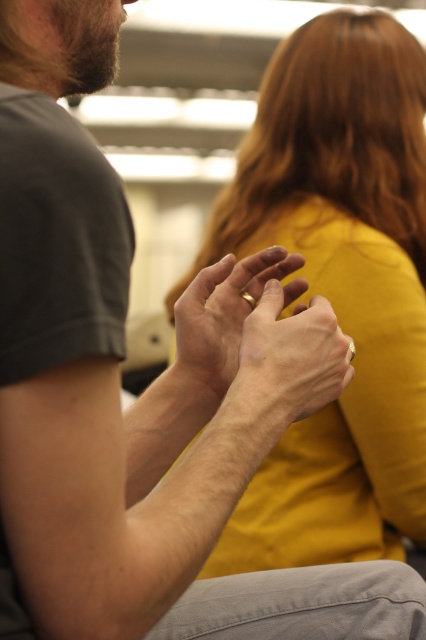
Question: Among these objects, which one is nearest to the camera?

Choices:
 (A) smooth skin hands at center
 (B) matte gold ring at center
 (C) mustard yellow fabric at upper right

Answer: (A)

Question: Does smooth skin hands at center come in front of matte gold ring at center?

Choices:
 (A) no
 (B) yes

Answer: (B)

Question: Estimate the real-world distances between objects in this image. Which object is closer to the mustard yellow fabric at upper right?

Choices:
 (A) matte gold ring at center
 (B) smooth skin hands at center

Answer: (A)

Question: Which is nearer to the matte gold ring at center?

Choices:
 (A) smooth skin hands at center
 (B) mustard yellow fabric at upper right

Answer: (A)

Question: Considering the relative positions of mustard yellow fabric at upper right and matte gold ring at center in the image provided, where is mustard yellow fabric at upper right located with respect to matte gold ring at center?

Choices:
 (A) left
 (B) right

Answer: (B)

Question: Observing the image, what is the correct spatial positioning of mustard yellow fabric at upper right in reference to smooth skin hands at center?

Choices:
 (A) below
 (B) above

Answer: (B)